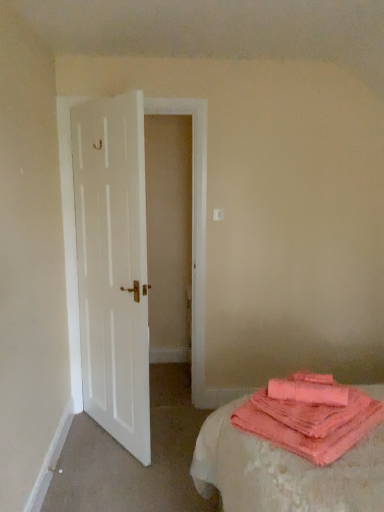
Question: Considering the positions of coral terry cloth at lower right and white wooden door at left in the image, is coral terry cloth at lower right taller or shorter than white wooden door at left?

Choices:
 (A) tall
 (B) short

Answer: (B)

Question: Is coral terry cloth at lower right bigger or smaller than white wooden door at left?

Choices:
 (A) big
 (B) small

Answer: (B)

Question: Which object is positioned closest to the coral terry cloth at lower right?

Choices:
 (A) white wooden door at left
 (B) coral soft towel at lower right

Answer: (B)

Question: Based on their relative distances, which object is nearer to the white wooden door at left?

Choices:
 (A) coral terry cloth at lower right
 (B) coral soft towel at lower right

Answer: (A)